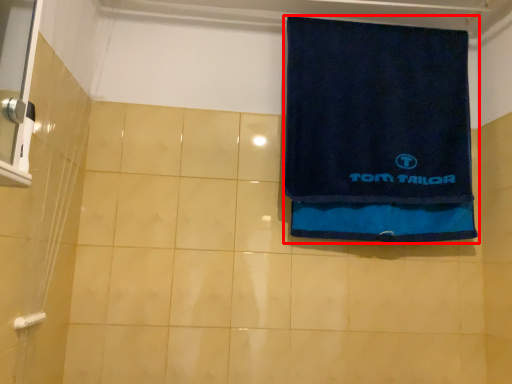
Question: From the image's perspective, where is towel (annotated by the red box) located relative to towel bar?

Choices:
 (A) below
 (B) above

Answer: (B)